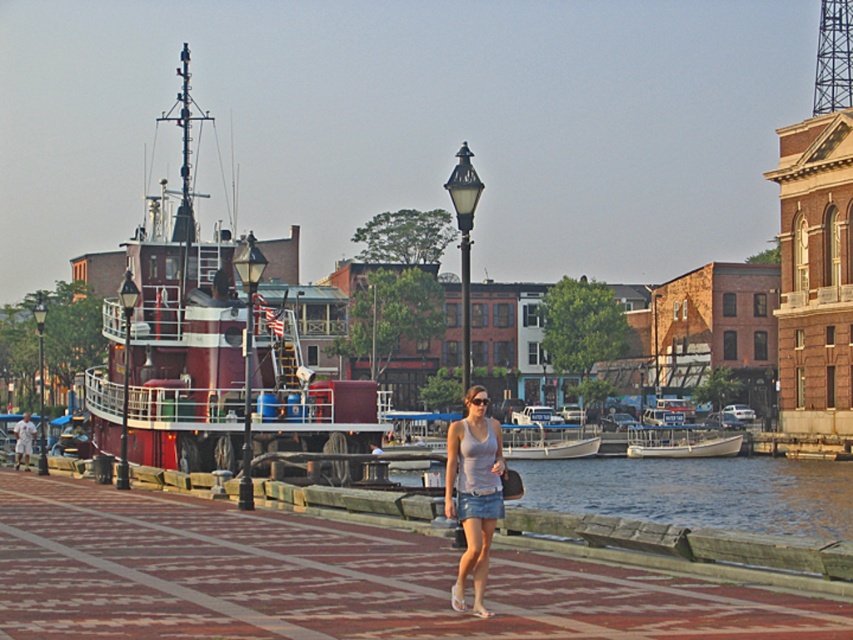
You are standing at the point labeled point (154, 241) and want to walk to point (463, 330). Given that you can only move along the paved walkway, will you be moving towards or away from the camera as you proceed?

As you move from point (154, 241) to point (463, 330) along the paved walkway, you will be moving away from the camera since point (463, 330) is farther from the camera compared to point (154, 241).

You are standing on the walkway and want to take a photo of both the red polished wood boat at left and the white fiberglass boat at center. Which boat should you focus on first to ensure both are in the frame?

You should focus on the red polished wood boat at left first because it is closer to you than the white fiberglass boat at center, so adjusting the focus to it will help capture both boats in the frame.

Consider the image. You are a photographer standing on the waterfront walkway. You want to capture a photo that includes both the red polished wood boat at left and the matte black lamp post at center. Based on their positions, will the boat appear in front of or behind the lamp post in the photo?

The red polished wood boat at left is located above matte black lamp post at center, so in the photo, the boat will appear behind the lamp post because it is positioned higher up in the scene.